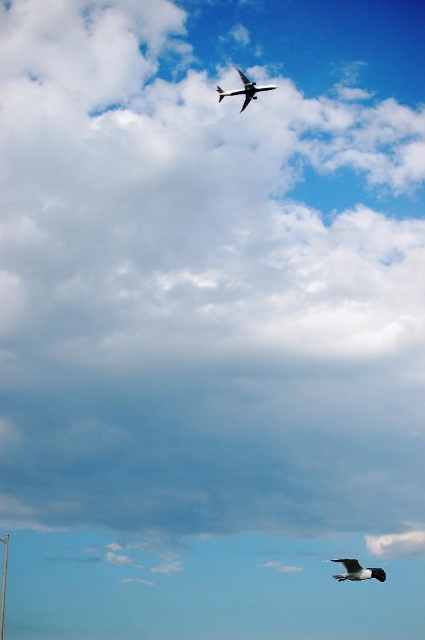
Between white feathered bird at lower center and metallic silver airplane at upper center, which one appears on the left side from the viewer's perspective?

From the viewer's perspective, metallic silver airplane at upper center appears more on the left side.

Where is `white feathered bird at lower center`? The height and width of the screenshot is (640, 425). white feathered bird at lower center is located at coordinates (357, 570).

You are a GUI agent. You are given a task and a screenshot of the screen. Output one action in this format:
    pyautogui.click(x=<x>, y=<y>)
    Task: Click on the white feathered bird at lower center
    This screenshot has width=425, height=640.
    Given the screenshot: What is the action you would take?
    pyautogui.click(x=357, y=570)